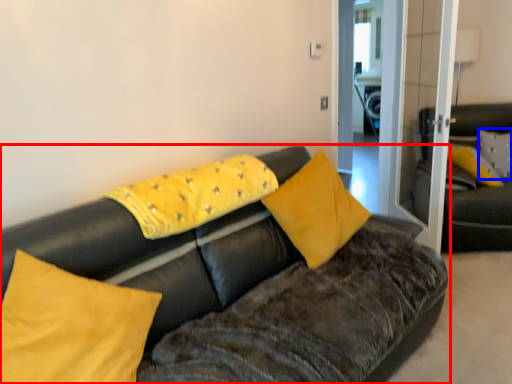
Question: Which object appears closest to the camera in this image, studio couch (highlighted by a red box) or pillow (highlighted by a blue box)?

Choices:
 (A) studio couch
 (B) pillow

Answer: (A)